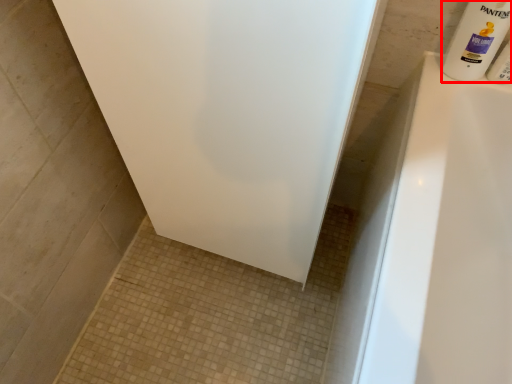
Question: From the image's perspective, what is the correct spatial relationship of cleaning product (annotated by the red box) in relation to toiletry?

Choices:
 (A) below
 (B) above

Answer: (B)